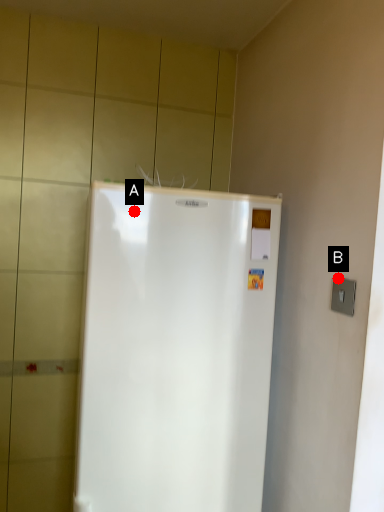
Question: Two points are circled on the image, labeled by A and B beside each circle. Which of the following is the closest to the observer?

Choices:
 (A) A is closer
 (B) B is closer

Answer: (B)